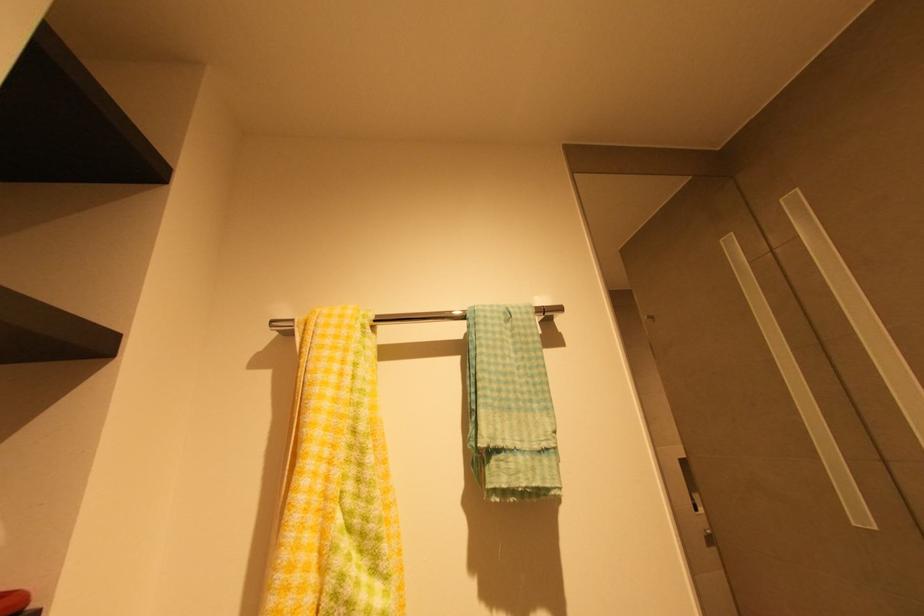
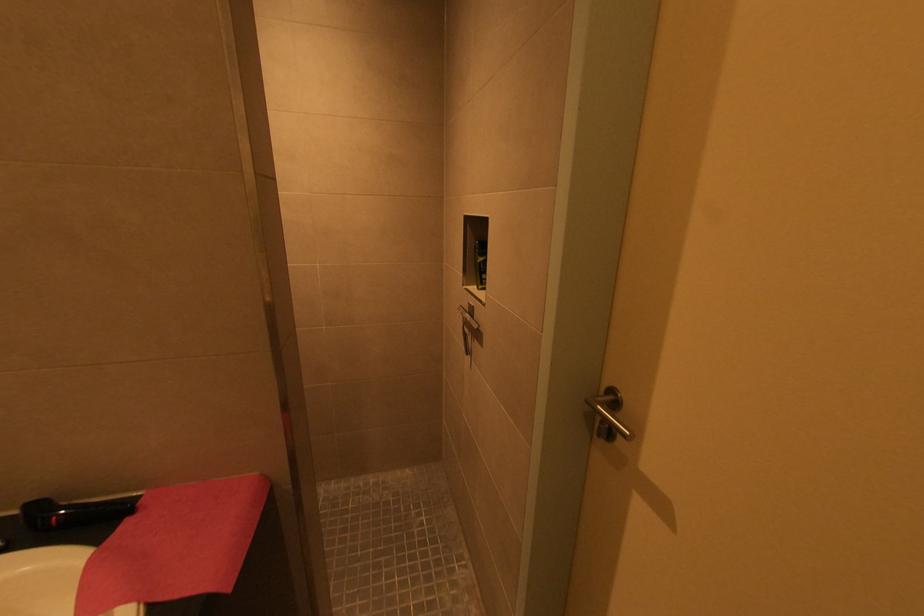
Question: Based on the continuous images, in which direction is the camera rotating? Reply with the corresponding letter.

Choices:
 (A) Left
 (B) Right
 (C) Up
 (D) Down

Answer: (B)